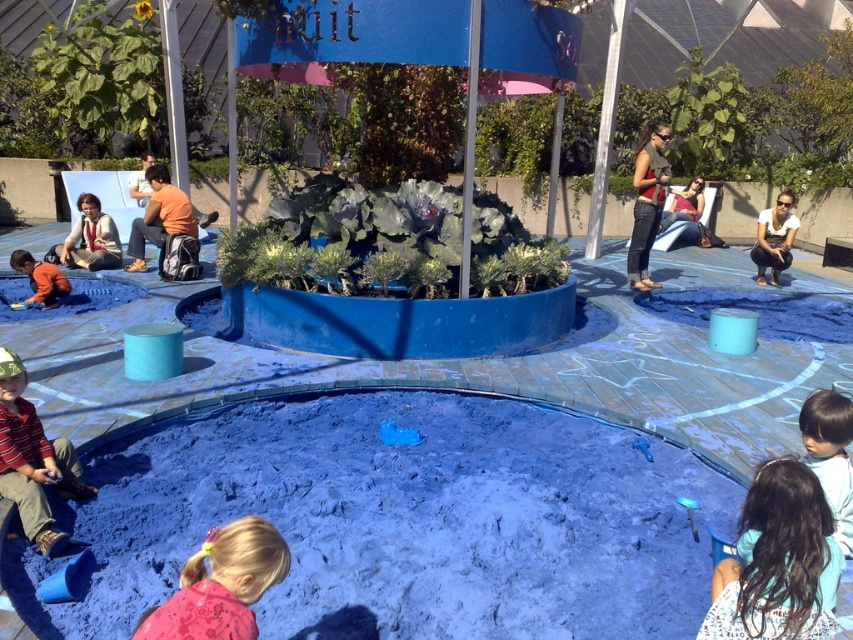
You are a photographer standing at the edge of the sandbox. You want to capture a photo of the dark brown hair at lower right without including the white chalk drawings in the foreground. Where should you position yourself to exclude the chalk drawings?

Position yourself to the left side of the sandbox so that the dark brown hair at lower right is framed away from the white chalk drawings at the edge.

You are standing at the edge of the sandbox and want to reach the point marked by coordinates point [230,552] and point [22,301]. Which point is closer to you?

Point [22,301] is closer to you because it is behind point [230,552], which is in front.

You are standing at the edge of the sandbox and want to place a small flag at each of the two points labeled point (780, 624) and point (62, 467). Which point will require you to walk further away from the sandbox to reach?

Point (62, 467) will require you to walk further away from the sandbox because it is farther from the viewer compared to point (780, 624), which is closer.